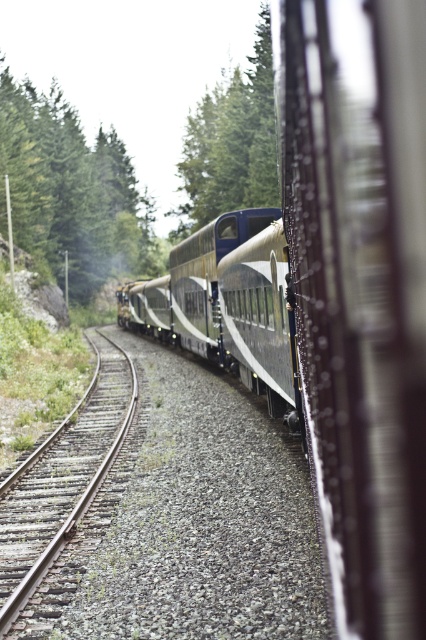
Is polished silver train at center positioned behind green textured tree at upper left?

No, polished silver train at center is closer to the viewer.

Who is taller, polished silver train at center or green textured tree at upper left?

With more height is green textured tree at upper left.

Does point (414, 538) lie in front of point (146, 273)?

Yes, point (414, 538) is closer to viewer.

Locate an element on the screen. Image resolution: width=426 pixels, height=640 pixels. polished silver train at center is located at coordinates (348, 296).

Can you confirm if polished silver train at center is shorter than brown gravel train track at left?

No.

Does polished silver train at center have a greater height compared to brown gravel train track at left?

Correct, polished silver train at center is much taller as brown gravel train track at left.

Between point (218, 339) and point (23, 596), which one is positioned in front?

Positioned in front is point (23, 596).

Find the location of a particular element. This screenshot has width=426, height=640. polished silver train at center is located at coordinates (348, 296).

From the picture: Can you confirm if green textured tree at upper left is smaller than green textured tree at upper center?

Actually, green textured tree at upper left might be larger than green textured tree at upper center.

Can you confirm if green textured tree at upper left is positioned to the right of green textured tree at upper center?

In fact, green textured tree at upper left is to the left of green textured tree at upper center.

Find the location of `green textured tree at upper left`. green textured tree at upper left is located at coordinates (72, 192).